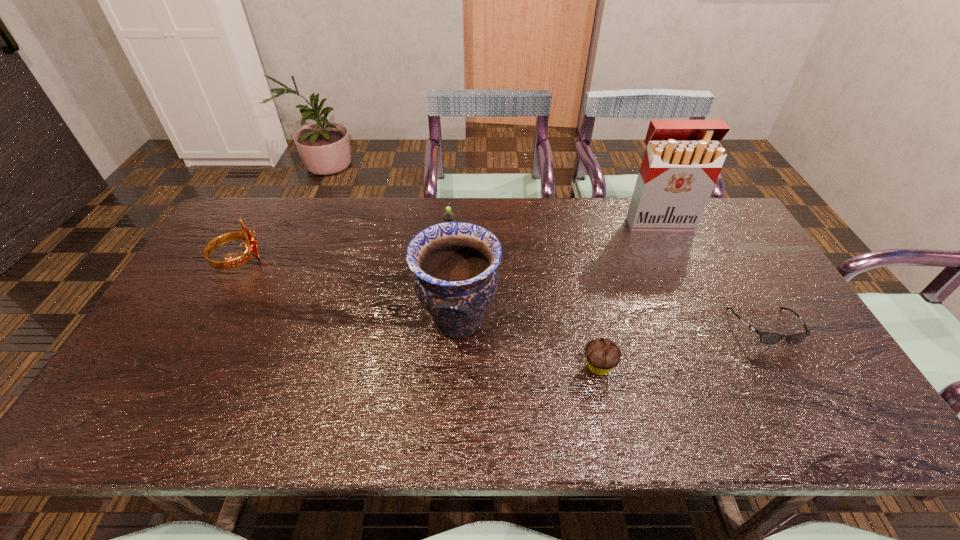
Identify the location of the farthest object. (682, 161).

Image resolution: width=960 pixels, height=540 pixels. What are the coordinates of `the tallest object` in the screenshot? It's located at (682, 161).

Find the location of `the second tallest object`. the second tallest object is located at coordinates (454, 264).

At what (x,y) coordinates should I click in order to perform the action: click on tiara. Please return your answer as a coordinate pair (x, y). Looking at the image, I should click on (251, 250).

You are a GUI agent. You are given a task and a screenshot of the screen. Output one action in this format:
    pyautogui.click(x=<x>, y=<y>)
    Task: Click on the leftmost object
    Image resolution: width=960 pixels, height=540 pixels.
    Given the screenshot: What is the action you would take?
    pyautogui.click(x=251, y=250)

Find the location of `the third shortest object`. the third shortest object is located at coordinates (448, 216).

You are a GUI agent. You are given a task and a screenshot of the screen. Output one action in this format:
    pyautogui.click(x=<x>, y=<y>)
    Task: Click on the muffin
    
    Given the screenshot: What is the action you would take?
    pyautogui.click(x=602, y=355)

I want to click on the fifth tallest object, so click(602, 355).

The height and width of the screenshot is (540, 960). I want to click on sunglasses, so click(x=768, y=338).

This screenshot has width=960, height=540. What are the coordinates of `free location located with the lid open on the cigarette case` in the screenshot? It's located at (670, 245).